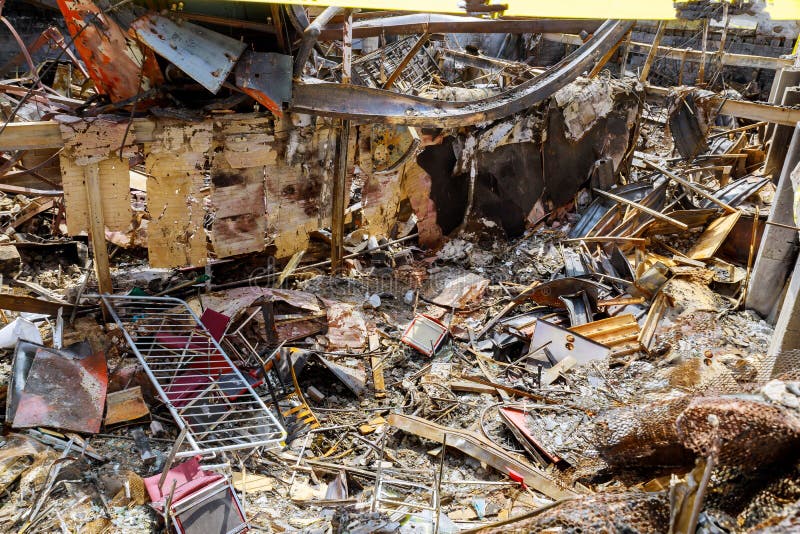
Locate an element on the screen. Image resolution: width=800 pixels, height=534 pixels. red chair is located at coordinates (216, 325), (218, 367).